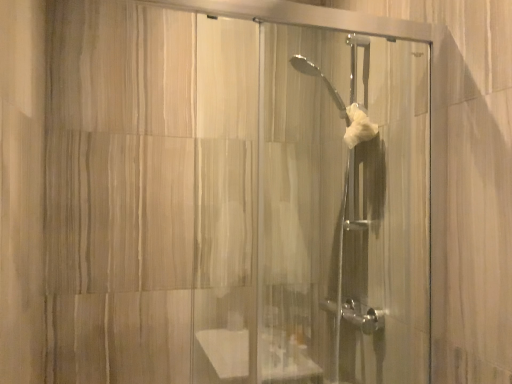
Describe the element at coordinates (358, 126) in the screenshot. I see `white fluffy hand towel at center` at that location.

You are a GUI agent. You are given a task and a screenshot of the screen. Output one action in this format:
    pyautogui.click(x=<x>, y=<y>)
    Task: Click on the white fluffy hand towel at center
    The image size is (512, 384).
    Given the screenshot: What is the action you would take?
    358,126

What is the approximate width of white fluffy hand towel at center?

3.84 inches.

What do you see at coordinates (343, 209) in the screenshot? The width and height of the screenshot is (512, 384). I see `clear glass shower door at center` at bounding box center [343, 209].

The image size is (512, 384). Identify the location of clear glass shower door at center. (343, 209).

Locate an element on the screen. white fluffy hand towel at center is located at coordinates (358, 126).

Considering the relative positions of clear glass shower door at center and white fluffy hand towel at center in the image provided, is clear glass shower door at center to the right of white fluffy hand towel at center from the viewer's perspective?

In fact, clear glass shower door at center is to the left of white fluffy hand towel at center.

Between clear glass shower door at center and white fluffy hand towel at center, which one is positioned behind?

white fluffy hand towel at center.

Which is less distant, (281, 363) or (369, 132)?

The point (281, 363) is closer to the camera.

From the image's perspective, which one is positioned lower, clear glass shower door at center or white fluffy hand towel at center?

clear glass shower door at center is shown below in the image.

From a real-world perspective, who is located lower, clear glass shower door at center or white fluffy hand towel at center?

clear glass shower door at center, from a real-world perspective.

Is clear glass shower door at center thinner than white fluffy hand towel at center?

No, clear glass shower door at center is not thinner than white fluffy hand towel at center.

Is clear glass shower door at center taller or shorter than white fluffy hand towel at center?

In the image, clear glass shower door at center appears to be taller than white fluffy hand towel at center.

Which of these two, clear glass shower door at center or white fluffy hand towel at center, is smaller?

Smaller between the two is white fluffy hand towel at center.

Which is correct: clear glass shower door at center is inside white fluffy hand towel at center, or outside of it?

The correct answer is: outside.

Is clear glass shower door at center not close to white fluffy hand towel at center?

Actually, clear glass shower door at center and white fluffy hand towel at center are a little close together.

Is clear glass shower door at center looking in the opposite direction of white fluffy hand towel at center?

Yes, clear glass shower door at center is positioned with its back facing white fluffy hand towel at center.

Measure the distance from clear glass shower door at center to white fluffy hand towel at center.

clear glass shower door at center is 12.96 inches away from white fluffy hand towel at center.

Locate an element on the screen. screen door that is under the white fluffy hand towel at center (from a real-world perspective) is located at coordinates (343, 209).

Which object is positioned more to the left, white fluffy hand towel at center or clear glass shower door at center?

clear glass shower door at center is more to the left.

Considering the relative positions of white fluffy hand towel at center and clear glass shower door at center in the image provided, is white fluffy hand towel at center behind clear glass shower door at center?

Yes, white fluffy hand towel at center is behind clear glass shower door at center.

Which is less distant, (x=377, y=131) or (x=291, y=177)?

Clearly, point (x=377, y=131) is closer to the camera than point (x=291, y=177).

From the image's perspective, between white fluffy hand towel at center and clear glass shower door at center, which one is located above?

white fluffy hand towel at center appears higher in the image.

From a real-world perspective, is white fluffy hand towel at center on clear glass shower door at center?

Yes.

Is white fluffy hand towel at center thinner than clear glass shower door at center?

Yes, white fluffy hand towel at center is thinner than clear glass shower door at center.

Is white fluffy hand towel at center taller or shorter than clear glass shower door at center?

In the image, white fluffy hand towel at center appears to be shorter than clear glass shower door at center.

Looking at the image, does white fluffy hand towel at center seem bigger or smaller compared to clear glass shower door at center?

white fluffy hand towel at center is smaller than clear glass shower door at center.

Do you think white fluffy hand towel at center is within clear glass shower door at center, or outside of it?

white fluffy hand towel at center is contained in clear glass shower door at center.

Would you say white fluffy hand towel at center is a long distance from clear glass shower door at center?

Actually, white fluffy hand towel at center and clear glass shower door at center are a little close together.

Based on the photo, is clear glass shower door at center at the back of white fluffy hand towel at center?

Yes, white fluffy hand towel at center's orientation is away from clear glass shower door at center.

How different are the orientations of white fluffy hand towel at center and clear glass shower door at center in degrees?

The facing directions of white fluffy hand towel at center and clear glass shower door at center are 3.9 degrees apart.

How distant is white fluffy hand towel at center from clear glass shower door at center?

A distance of 12.96 inches exists between white fluffy hand towel at center and clear glass shower door at center.

Identify the location of screen door that is below the white fluffy hand towel at center (from the image's perspective). click(x=343, y=209).

Identify the location of hand towel located on the right of clear glass shower door at center. (358, 126).

The width and height of the screenshot is (512, 384). Identify the location of hand towel above the clear glass shower door at center (from the image's perspective). (358, 126).